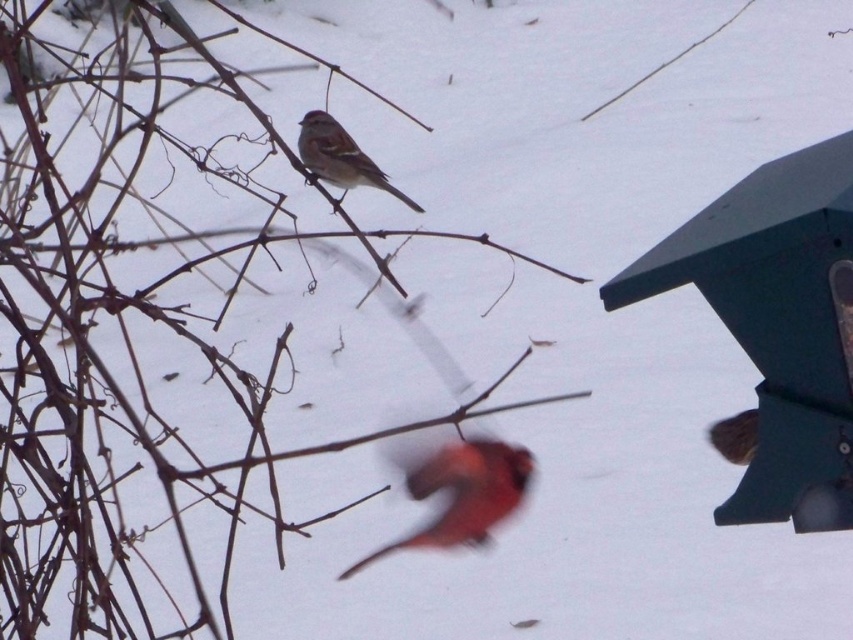
Question: Where is blurred orange bird at center located in relation to brown matte sparrow at center in the image?

Choices:
 (A) below
 (B) above

Answer: (A)

Question: Where is blurred orange bird at center located in relation to brown matte sparrow at center in the image?

Choices:
 (A) right
 (B) left

Answer: (A)

Question: Which point is farther to the camera?

Choices:
 (A) (357, 145)
 (B) (444, 488)

Answer: (A)

Question: Among these points, which one is farthest from the camera?

Choices:
 (A) pos(494,486)
 (B) pos(316,145)

Answer: (B)

Question: Is blurred orange bird at center bigger than brown matte sparrow at center?

Choices:
 (A) no
 (B) yes

Answer: (B)

Question: Among these points, which one is nearest to the camera?

Choices:
 (A) (424, 529)
 (B) (345, 148)

Answer: (A)